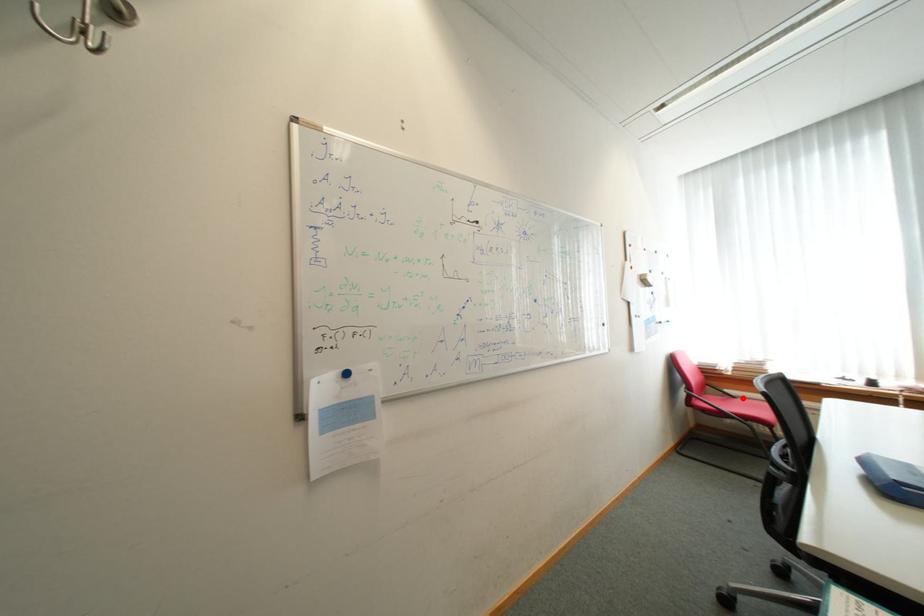
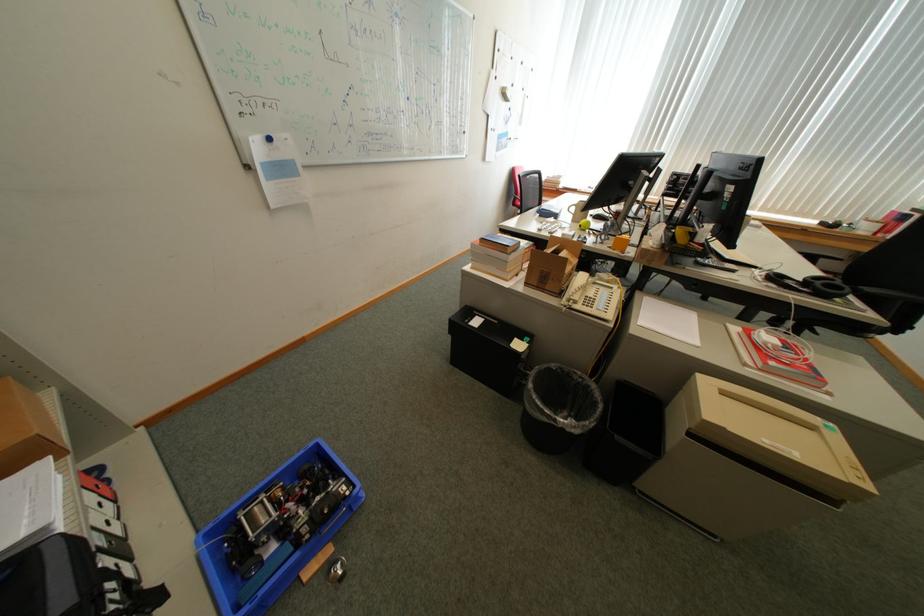
Question: I am providing you with two images of the same scene from different viewpoints. A red point is marked on the first image. Can you still see the location of the red point in image 2?

Choices:
 (A) Yes
 (B) No

Answer: (B)